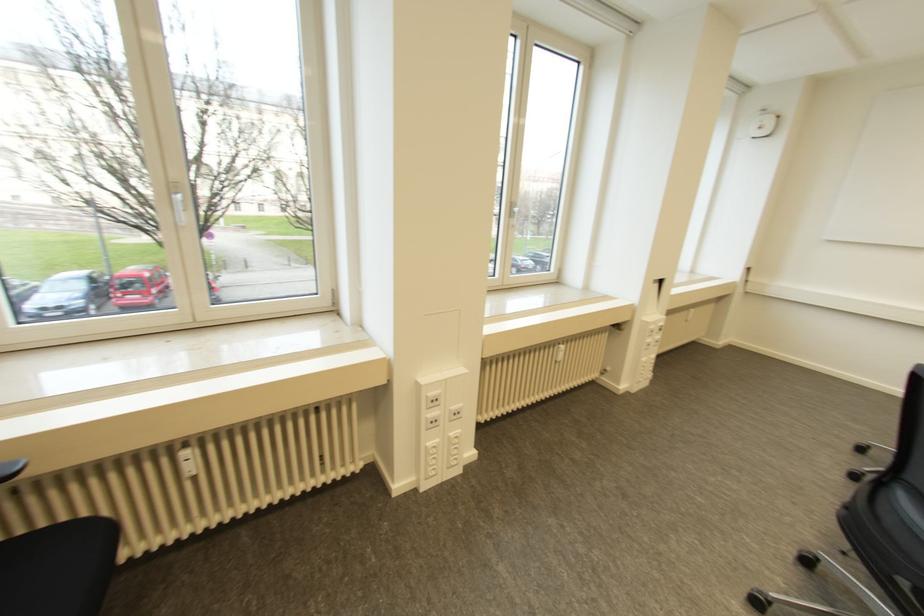
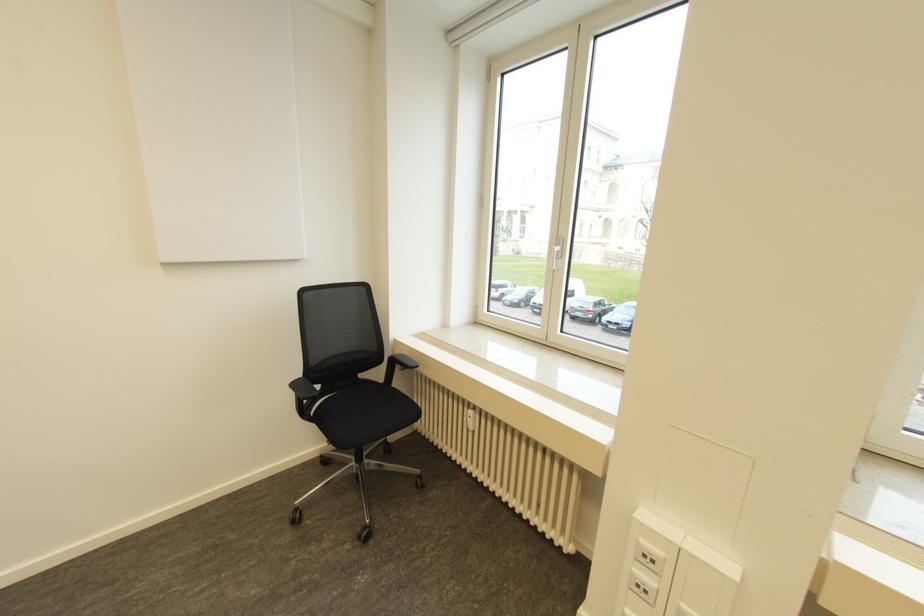
Where in the second image is the point corresponding to point 431,422 from the first image?

(637, 585)